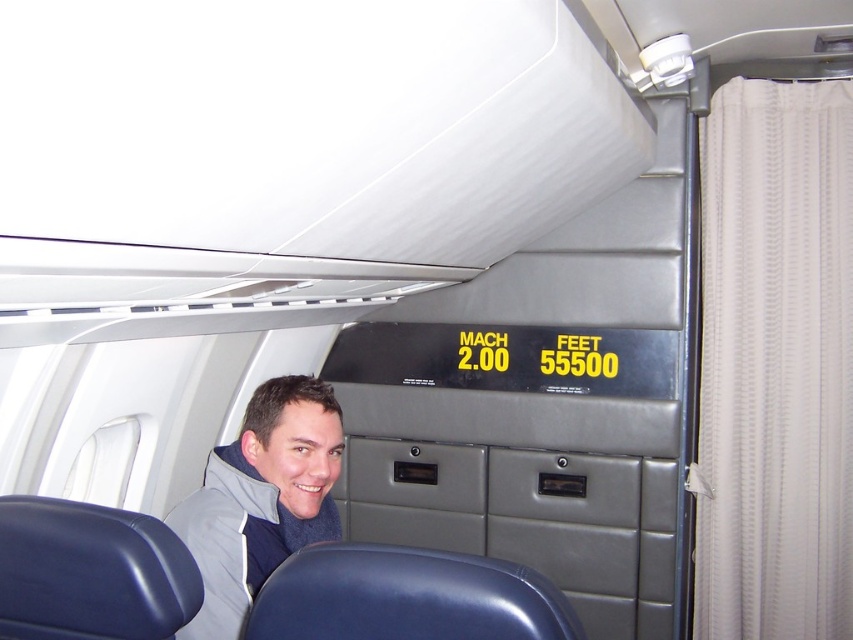
Question: Is gray fleece jacket at lower left thinner than blue leather seat at lower center?

Choices:
 (A) no
 (B) yes

Answer: (B)

Question: Among these objects, which one is nearest to the camera?

Choices:
 (A) blue leather seat at lower center
 (B) gray fleece jacket at lower left

Answer: (A)

Question: Can you confirm if gray fleece jacket at lower left is positioned above blue leather seat at lower center?

Choices:
 (A) yes
 (B) no

Answer: (B)

Question: From the image, what is the correct spatial relationship of gray fleece jacket at lower left in relation to blue leather seat at lower center?

Choices:
 (A) below
 (B) above

Answer: (A)

Question: Which point appears farthest from the camera in this image?

Choices:
 (A) pos(235,451)
 (B) pos(480,584)

Answer: (A)

Question: Among these points, which one is farthest from the camera?

Choices:
 (A) (306, 435)
 (B) (370, 628)

Answer: (A)